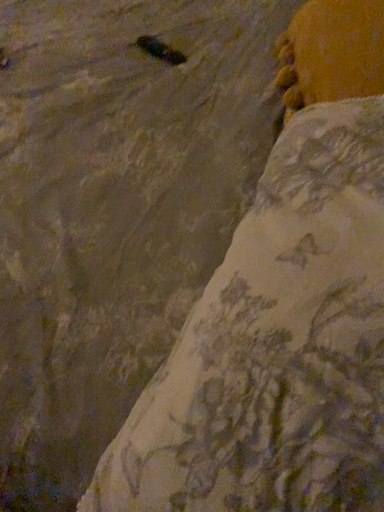
At what (x,y) coordinates should I click in order to perform the action: click on shiny black insect at upper left. Please return your answer as a coordinate pair (x, y). The width and height of the screenshot is (384, 512). Looking at the image, I should click on (160, 50).

The image size is (384, 512). What do you see at coordinates (160, 50) in the screenshot?
I see `shiny black insect at upper left` at bounding box center [160, 50].

Where is `shiny black insect at upper left`? This screenshot has height=512, width=384. shiny black insect at upper left is located at coordinates (160, 50).